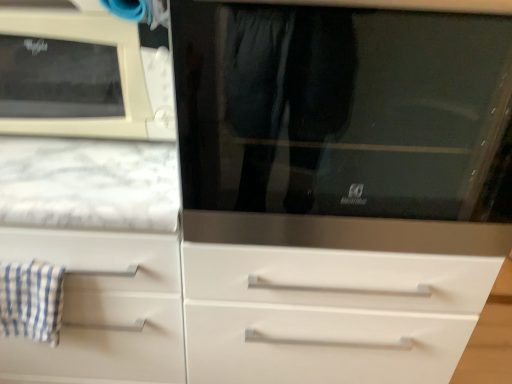
Question: Considering the relative sizes of stainless steel microwave at center and blue checkered cloth at left in the image provided, is stainless steel microwave at center shorter than blue checkered cloth at left?

Choices:
 (A) yes
 (B) no

Answer: (B)

Question: Is stainless steel microwave at center turned away from blue checkered cloth at left?

Choices:
 (A) no
 (B) yes

Answer: (A)

Question: Is the surface of stainless steel microwave at center in direct contact with blue checkered cloth at left?

Choices:
 (A) no
 (B) yes

Answer: (A)

Question: From a real-world perspective, is stainless steel microwave at center physically below blue checkered cloth at left?

Choices:
 (A) yes
 (B) no

Answer: (B)

Question: Considering the relative positions of stainless steel microwave at center and blue checkered cloth at left in the image provided, is stainless steel microwave at center to the right of blue checkered cloth at left from the viewer's perspective?

Choices:
 (A) yes
 (B) no

Answer: (A)

Question: In the image, is stainless steel microwave at center positioned in front of or behind beige plastic microwave at upper left?

Choices:
 (A) front
 (B) behind

Answer: (A)

Question: Is point (261, 69) closer or farther from the camera than point (13, 21)?

Choices:
 (A) farther
 (B) closer

Answer: (A)

Question: Is stainless steel microwave at center situated inside beige plastic microwave at upper left or outside?

Choices:
 (A) outside
 (B) inside

Answer: (A)

Question: Considering the positions of stainless steel microwave at center and beige plastic microwave at upper left in the image, is stainless steel microwave at center taller or shorter than beige plastic microwave at upper left?

Choices:
 (A) short
 (B) tall

Answer: (B)

Question: Do you think blue checkered cloth at left is within beige plastic microwave at upper left, or outside of it?

Choices:
 (A) outside
 (B) inside

Answer: (A)

Question: From their relative heights in the image, would you say blue checkered cloth at left is taller or shorter than beige plastic microwave at upper left?

Choices:
 (A) tall
 (B) short

Answer: (B)

Question: From a real-world perspective, relative to beige plastic microwave at upper left, is blue checkered cloth at left vertically above or below?

Choices:
 (A) above
 (B) below

Answer: (B)

Question: Based on their positions, is blue checkered cloth at left located to the left or right of beige plastic microwave at upper left?

Choices:
 (A) left
 (B) right

Answer: (A)

Question: From the image's perspective, is beige plastic microwave at upper left located above or below stainless steel microwave at center?

Choices:
 (A) below
 (B) above

Answer: (B)

Question: In terms of size, does beige plastic microwave at upper left appear bigger or smaller than stainless steel microwave at center?

Choices:
 (A) small
 (B) big

Answer: (A)